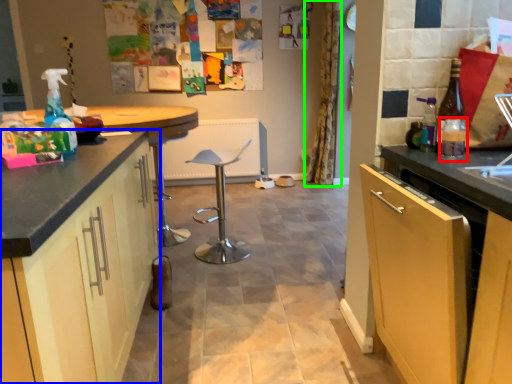
Question: Considering the real-world distances, which object is farthest from bottle (highlighted by a red box)? cabinetry (highlighted by a blue box) or curtain (highlighted by a green box)?

Choices:
 (A) cabinetry
 (B) curtain

Answer: (B)